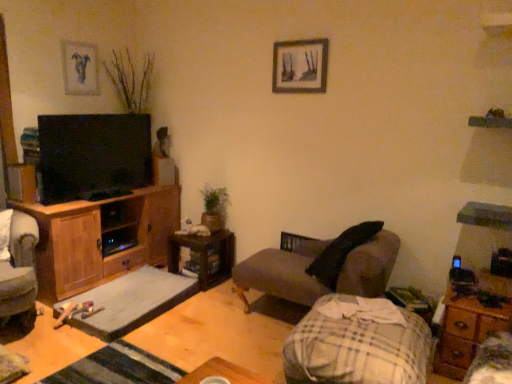
Locate an element on the screen. vacant region above brown wooden side table at center (from a real-world perspective) is located at coordinates (210, 230).